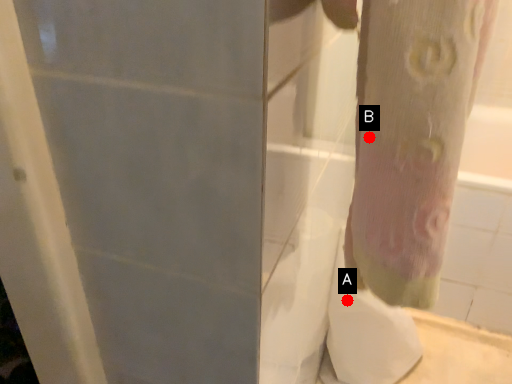
Question: Two points are circled on the image, labeled by A and B beside each circle. Which point is farther to the camera?

Choices:
 (A) A is further
 (B) B is further

Answer: (A)